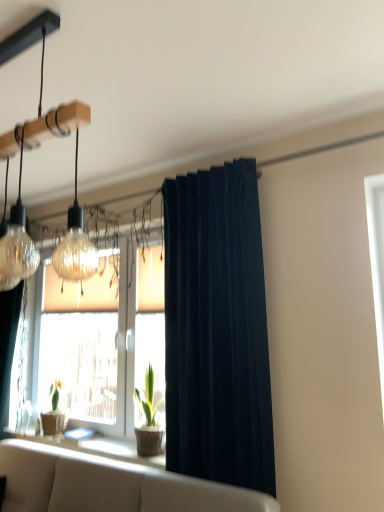
Question: Can wooden textured window sill at lower center be found inside dark blue velvet curtain at center?

Choices:
 (A) yes
 (B) no

Answer: (B)

Question: Considering the relative positions of dark blue velvet curtain at center and wooden textured window sill at lower center in the image provided, is dark blue velvet curtain at center in front of wooden textured window sill at lower center?

Choices:
 (A) yes
 (B) no

Answer: (A)

Question: From the image's perspective, is dark blue velvet curtain at center under wooden textured window sill at lower center?

Choices:
 (A) no
 (B) yes

Answer: (A)

Question: Is dark blue velvet curtain at center thinner than wooden textured window sill at lower center?

Choices:
 (A) no
 (B) yes

Answer: (B)

Question: From a real-world perspective, is dark blue velvet curtain at center located beneath wooden textured window sill at lower center?

Choices:
 (A) no
 (B) yes

Answer: (A)

Question: Is dark blue velvet curtain at center inside or outside of beige fabric couch at lower center?

Choices:
 (A) inside
 (B) outside

Answer: (B)

Question: From the image's perspective, is dark blue velvet curtain at center above or below beige fabric couch at lower center?

Choices:
 (A) below
 (B) above

Answer: (B)

Question: From a real-world perspective, is dark blue velvet curtain at center positioned above or below beige fabric couch at lower center?

Choices:
 (A) above
 (B) below

Answer: (A)

Question: In the image, is dark blue velvet curtain at center positioned in front of or behind beige fabric couch at lower center?

Choices:
 (A) front
 (B) behind

Answer: (B)

Question: In the image, is green matte plant at center on the left side or the right side of beige fabric couch at lower center?

Choices:
 (A) right
 (B) left

Answer: (A)

Question: From the image's perspective, relative to beige fabric couch at lower center, is green matte plant at center above or below?

Choices:
 (A) below
 (B) above

Answer: (B)

Question: Does point (140, 456) appear closer or farther from the camera than point (9, 490)?

Choices:
 (A) closer
 (B) farther

Answer: (B)

Question: In terms of width, does green matte plant at center look wider or thinner when compared to beige fabric couch at lower center?

Choices:
 (A) thin
 (B) wide

Answer: (A)

Question: Considering their positions, is green matte plant at center located in front of or behind matte glass pendant light at upper left?

Choices:
 (A) front
 (B) behind

Answer: (B)

Question: Is green matte plant at center taller or shorter than matte glass pendant light at upper left?

Choices:
 (A) short
 (B) tall

Answer: (A)